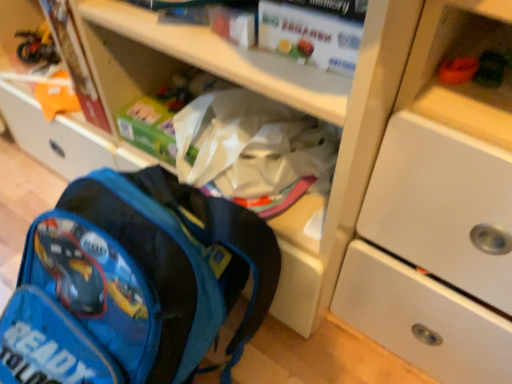
Question: From a real-world perspective, is white matte cabinet at upper right positioned above or below matte cardboard book at upper left, which ranks as the first paperback book in back-to-front order?

Choices:
 (A) above
 (B) below

Answer: (B)

Question: In terms of size, does white matte cabinet at upper right appear bigger or smaller than matte cardboard book at upper left, marked as the 2th paperback book in a front-to-back arrangement?

Choices:
 (A) small
 (B) big

Answer: (B)

Question: Estimate the real-world distances between objects in this image. Which object is closer to the white matte cabinet at upper right?

Choices:
 (A) matte cardboard book at upper left, the second paperback book viewed from the right
 (B) white matte paper at upper center, marked as the 2th paperback book in a left-to-right arrangement
 (C) green fuzzy toy at upper right
 (D) blue fabric backpack at lower left

Answer: (C)

Question: Estimate the real-world distances between objects in this image. Which object is farther from the white matte cabinet at upper right?

Choices:
 (A) blue fabric backpack at lower left
 (B) matte cardboard book at upper left, acting as the first paperback book starting from the left
 (C) green fuzzy toy at upper right
 (D) white matte paper at upper center, the 1th paperback book from the right

Answer: (B)